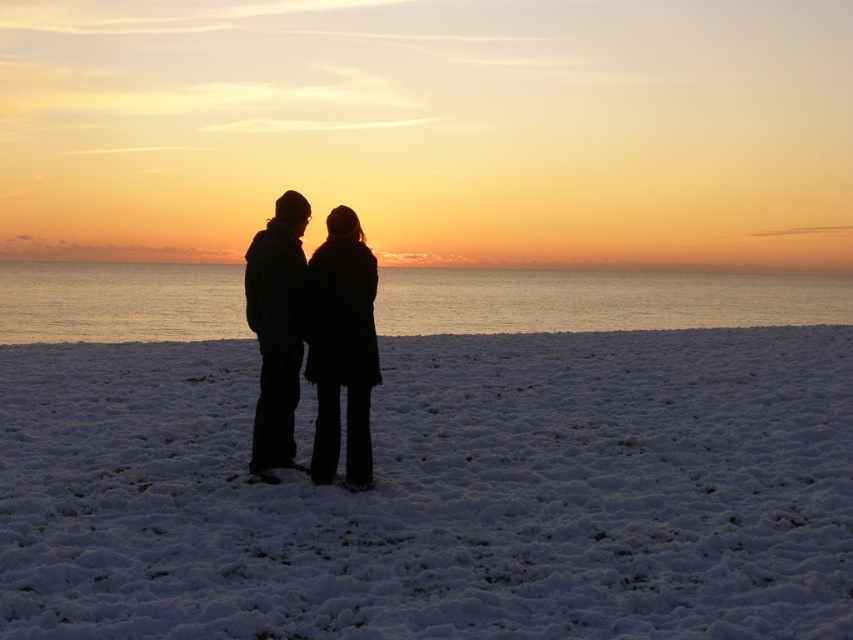
Question: Based on their relative distances, which object is nearer to the black fuzzy coat at center?

Choices:
 (A) black matte coat at center
 (B) white fluffy snow at center

Answer: (A)

Question: Which object is farther from the camera taking this photo?

Choices:
 (A) black fuzzy coat at center
 (B) black matte coat at center
 (C) white fluffy snow at center

Answer: (B)

Question: Observing the image, what is the correct spatial positioning of white fluffy snow at center in reference to black fuzzy coat at center?

Choices:
 (A) above
 (B) below

Answer: (B)

Question: Which of the following is the closest to the observer?

Choices:
 (A) black fuzzy coat at center
 (B) black matte coat at center

Answer: (A)

Question: Is white fluffy snow at center thinner than black fuzzy coat at center?

Choices:
 (A) yes
 (B) no

Answer: (B)

Question: Is black fuzzy coat at center bigger than black matte coat at center?

Choices:
 (A) yes
 (B) no

Answer: (A)